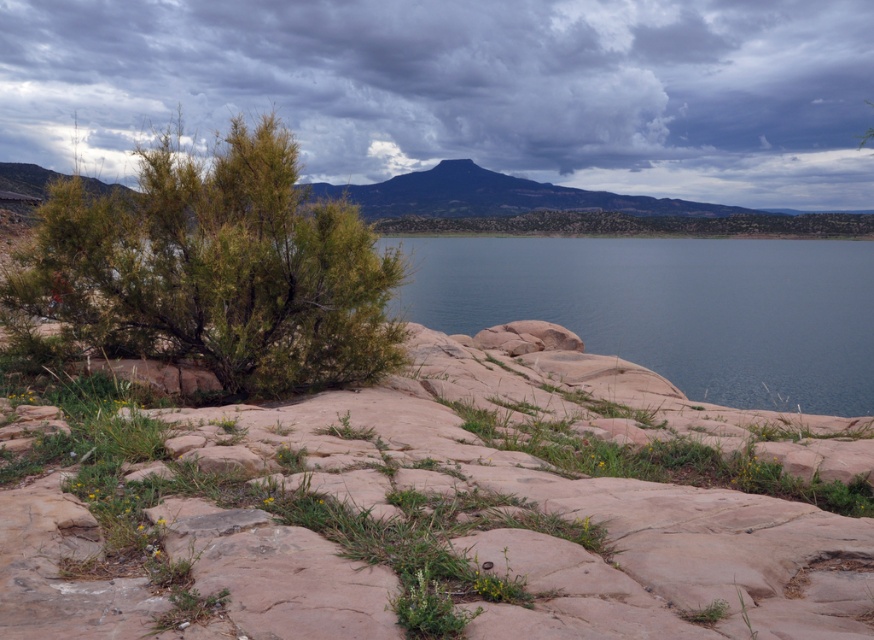
You are standing in the middle of the rocky terrain and want to look at both the cloudy sky at upper center and the blue smooth water at center. Which object is located to the left when you face the scene?

The cloudy sky at upper center is located to the left of the blue smooth water at center.

You are standing in the landscape scene and want to look at the point at coordinates (466, 90). Where exactly in the image should you look?

The point at coordinates (466, 90) is located on the cloudy sky at upper center.